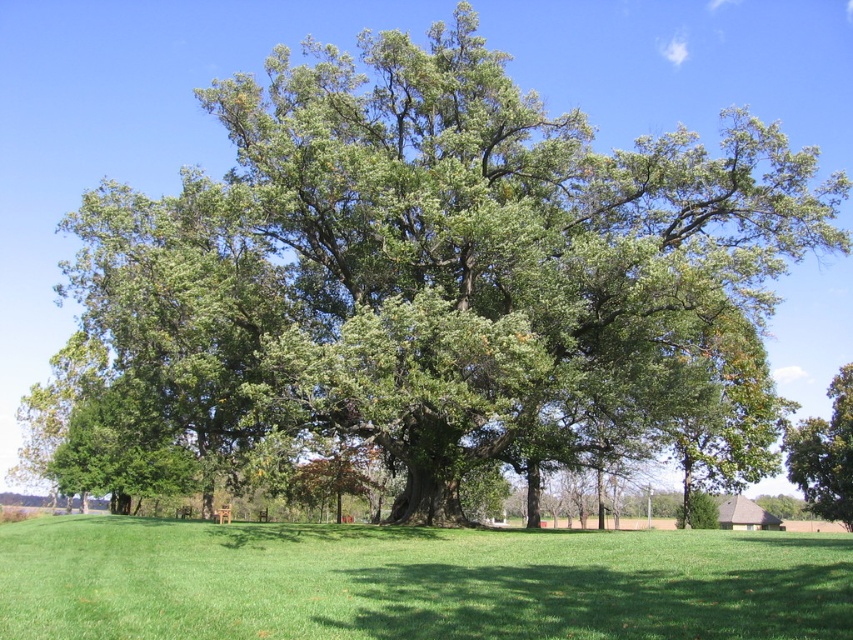
Can you confirm if green grass at center is bigger than green leafy tree at center?

Incorrect, green grass at center is not larger than green leafy tree at center.

Does green grass at center appear under green leafy tree at center?

No, green grass at center is not below green leafy tree at center.

Based on the photo, measure the distance between point (554, 544) and camera.

Point (554, 544) and camera are 21.65 meters apart from each other.

Locate an element on the screen. green grass at center is located at coordinates (415, 580).